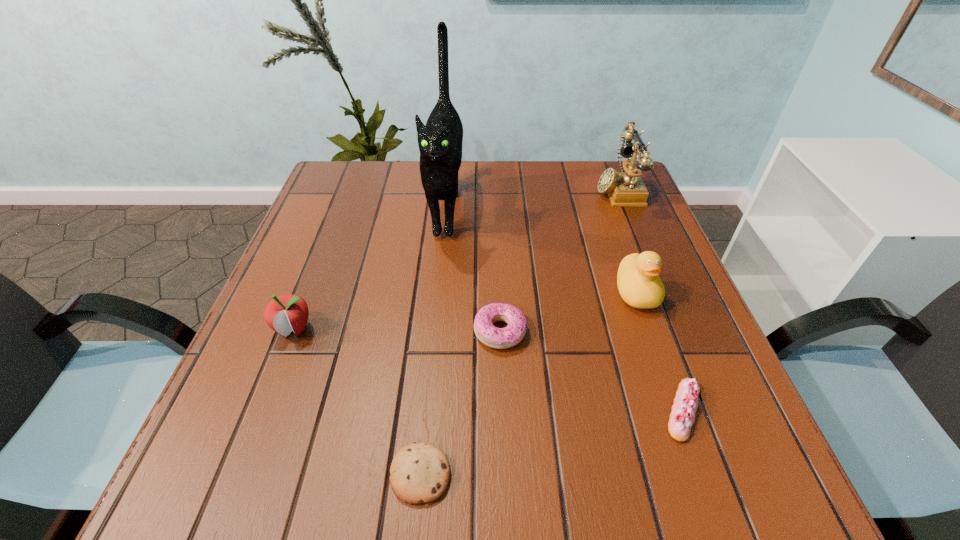
Where is `the nearest object`? the nearest object is located at coordinates (419, 473).

Identify the location of free location located on the face of the tallest object. This screenshot has width=960, height=540. (429, 390).

This screenshot has height=540, width=960. What are the coordinates of `vacant region located 0.290m on the dial number of the telephone` in the screenshot? It's located at (491, 189).

Locate an element on the screen. free space located on the dial number of the telephone is located at coordinates (548, 189).

Identify the location of free spot located 0.380m on the dial number of the telephone. Image resolution: width=960 pixels, height=540 pixels. (458, 189).

Locate an element on the screen. free point located 0.240m on the face of the third tallest object is located at coordinates (684, 426).

The height and width of the screenshot is (540, 960). What are the coordinates of `blank space located on the right of the fourth tallest object` in the screenshot? It's located at (441, 329).

The image size is (960, 540). Identify the location of vacant space located 0.190m on the back of the fifth tallest object. (496, 251).

This screenshot has width=960, height=540. Find the location of `free point located on the left of the eclair`. free point located on the left of the eclair is located at coordinates (517, 410).

At what (x,y) coordinates should I click in order to perform the action: click on vacant space situated on the right of the nearest object. Please return your answer as a coordinate pair (x, y). The width and height of the screenshot is (960, 540). Looking at the image, I should click on (503, 474).